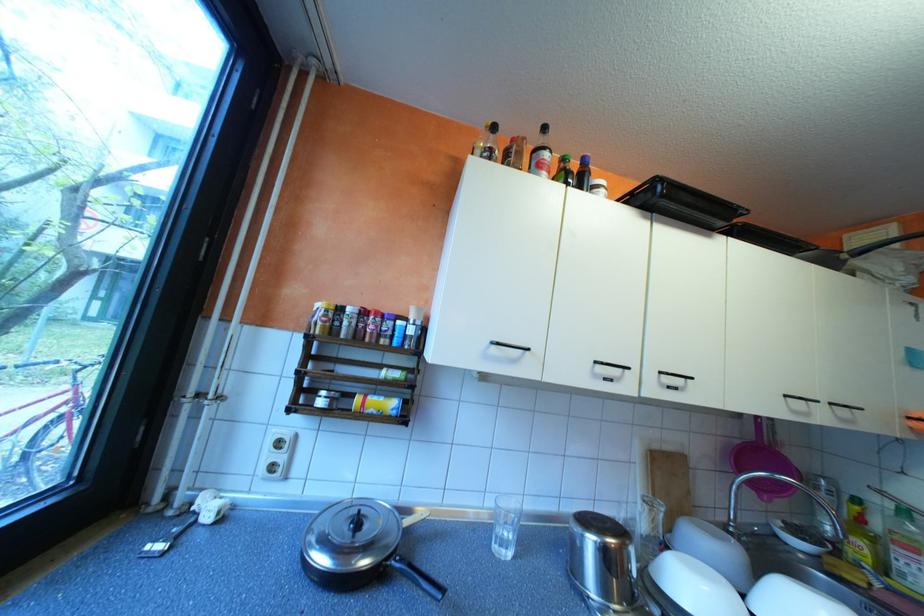
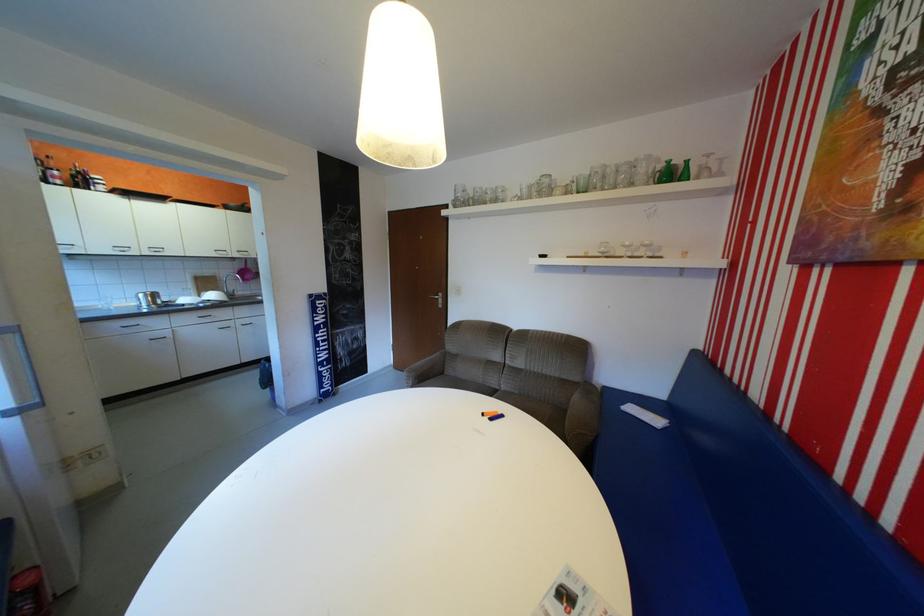
The point at (752, 592) is marked in the first image. Where is the corresponding point in the second image?

(215, 298)